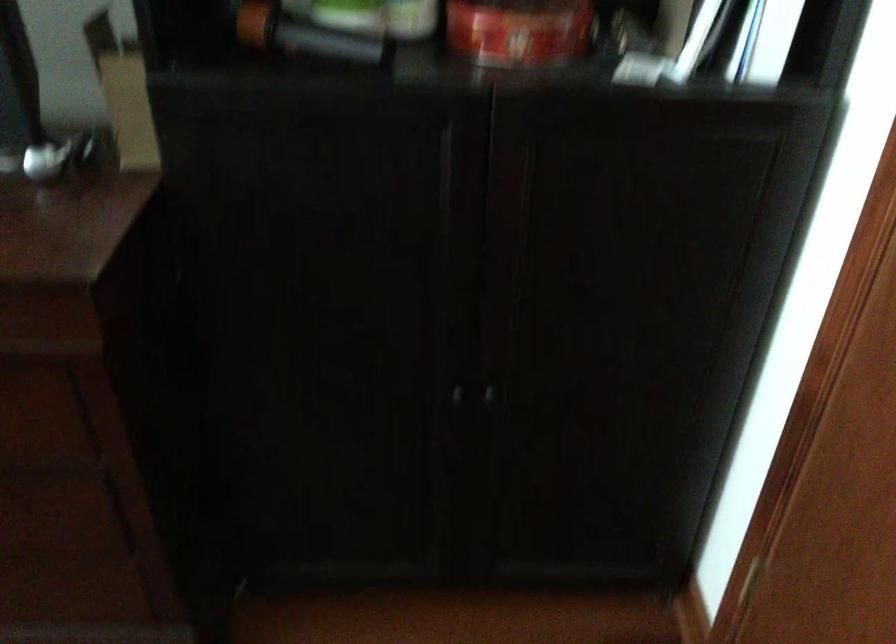
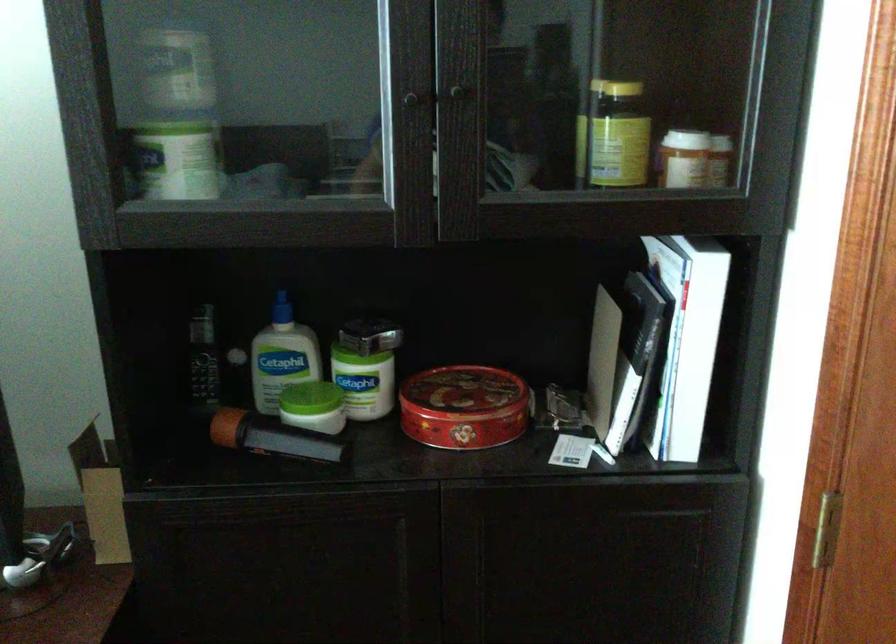
The point at (x=770, y=181) is marked in the first image. Where is the corresponding point in the second image?

(707, 554)